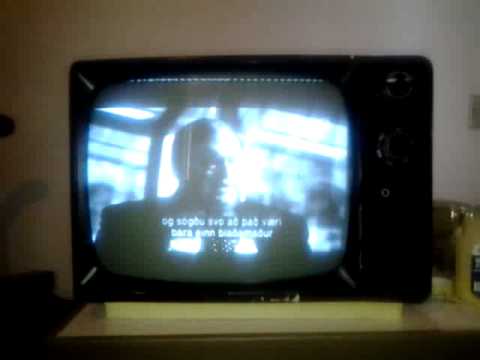
The height and width of the screenshot is (360, 480). What are the coordinates of `screen` in the screenshot? It's located at (219, 189).